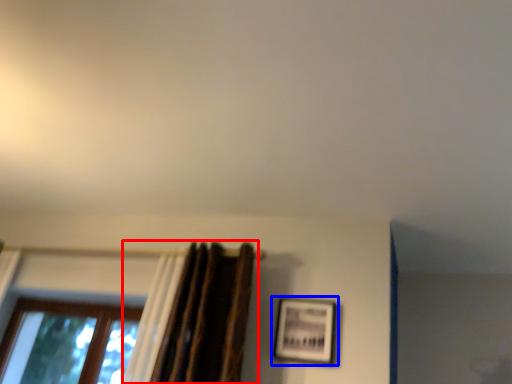
Question: Among these objects, which one is farthest to the camera, curtain (highlighted by a red box) or picture frame (highlighted by a blue box)?

Choices:
 (A) curtain
 (B) picture frame

Answer: (B)